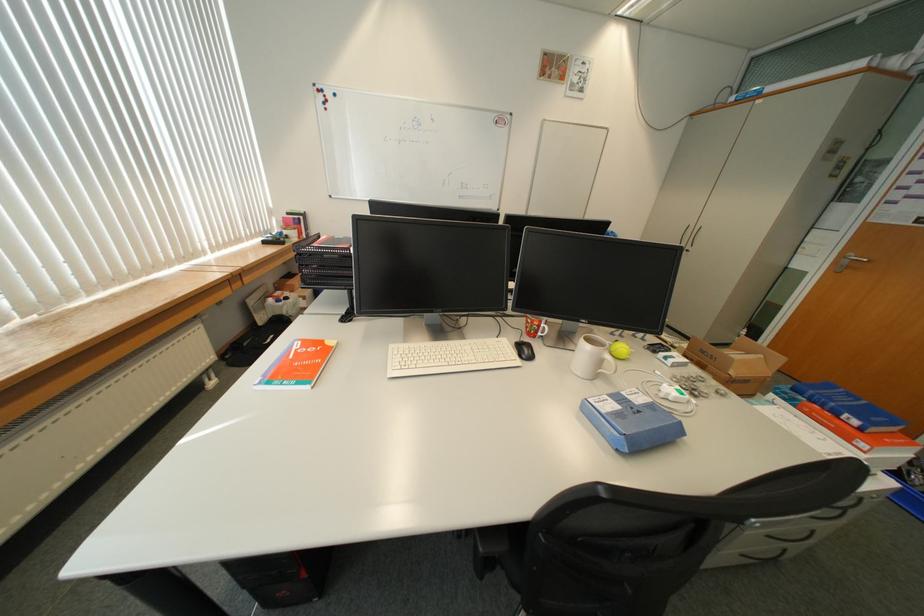
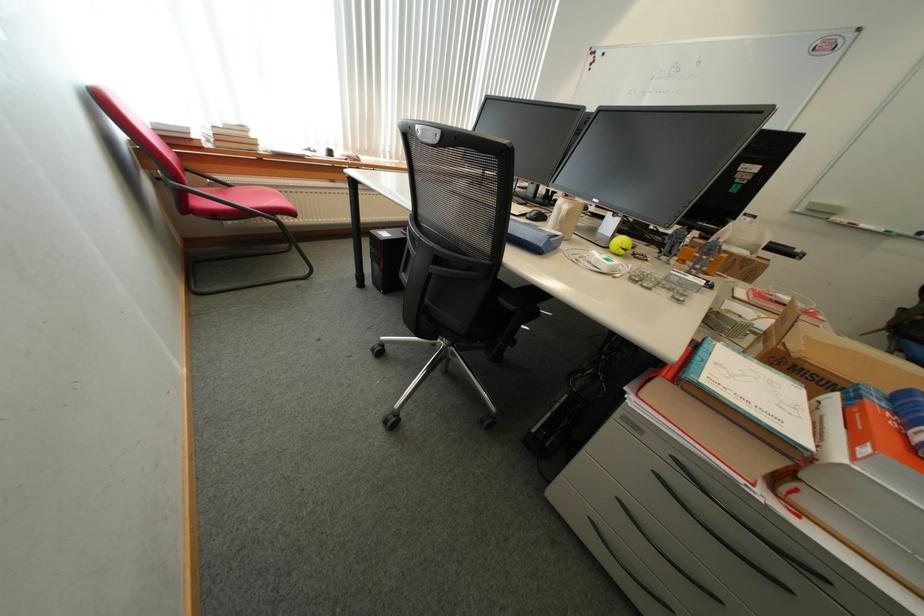
Locate, in the second image, the point that corresponds to point (822, 403) in the first image.

(906, 415)